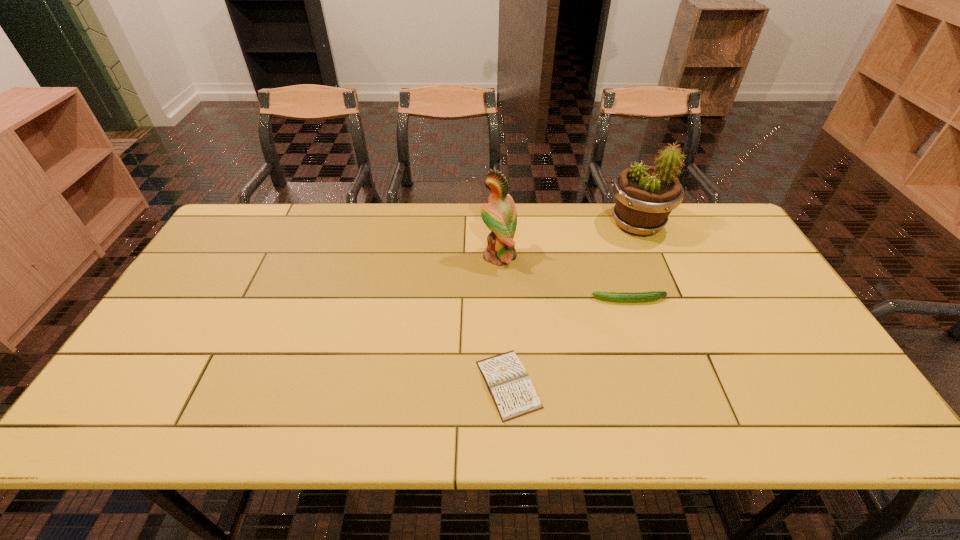
Identify the location of free region at the right edge of the desktop. The image size is (960, 540). (774, 362).

Locate an element on the screen. The height and width of the screenshot is (540, 960). free location at the far right corner of the desktop is located at coordinates (704, 240).

In the image, there is a desktop. In order to click on vacant region at the near right corner in this screenshot , I will do `click(782, 406)`.

You are a GUI agent. You are given a task and a screenshot of the screen. Output one action in this format:
    pyautogui.click(x=<x>, y=<y>)
    Task: Click on the blank region between the shortest object and the flowerpot
    Image resolution: width=960 pixels, height=540 pixels.
    Given the screenshot: What is the action you would take?
    pyautogui.click(x=573, y=304)

Where is `vacant area between the third farthest object and the shortest object`? The height and width of the screenshot is (540, 960). vacant area between the third farthest object and the shortest object is located at coordinates (569, 342).

You are a GUI agent. You are given a task and a screenshot of the screen. Output one action in this format:
    pyautogui.click(x=<x>, y=<y>)
    Task: Click on the free space between the parrot and the zucchini
    This screenshot has height=540, width=960.
    Given the screenshot: What is the action you would take?
    pyautogui.click(x=564, y=278)

The height and width of the screenshot is (540, 960). Find the location of `blank region between the second shortest object and the diary`. blank region between the second shortest object and the diary is located at coordinates (569, 342).

At what (x,y) coordinates should I click in order to perform the action: click on free space between the nearest object and the parrot. Please return your answer as a coordinate pair (x, y). Image resolution: width=960 pixels, height=540 pixels. Looking at the image, I should click on (503, 320).

Where is `vacant area that lies between the third farthest object and the flowerpot`? vacant area that lies between the third farthest object and the flowerpot is located at coordinates (634, 262).

Locate an element on the screen. empty space between the diary and the parrot is located at coordinates (503, 320).